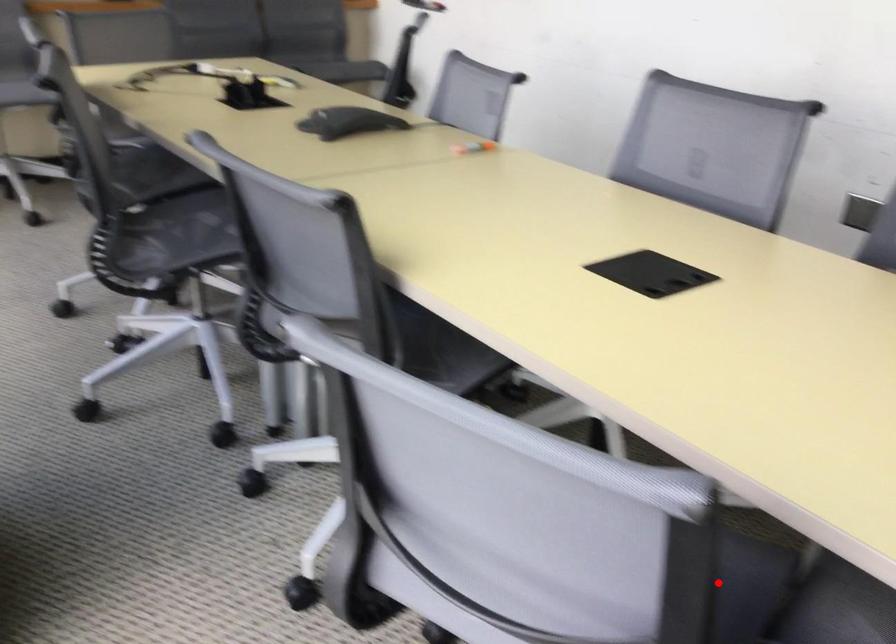
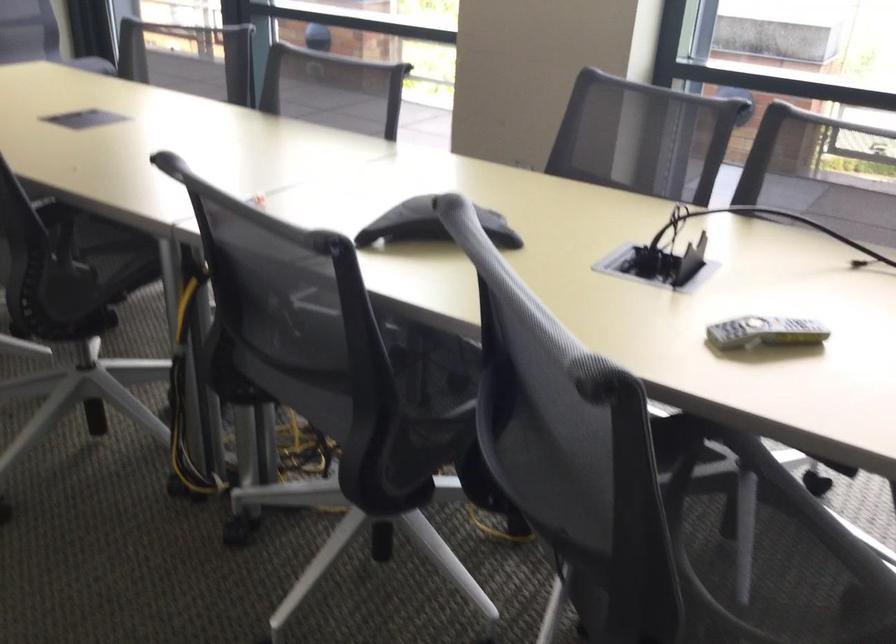
Question: I am providing you with two images of the same scene from different viewpoints. A red point is marked on the first image. Is the red point's position out of view in image 2?

Choices:
 (A) Yes
 (B) No

Answer: (A)